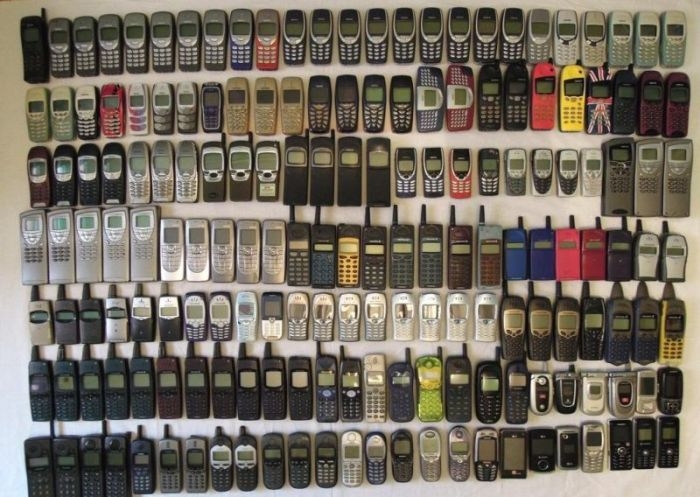
This screenshot has height=497, width=700. I want to click on key board, so click(x=274, y=258).